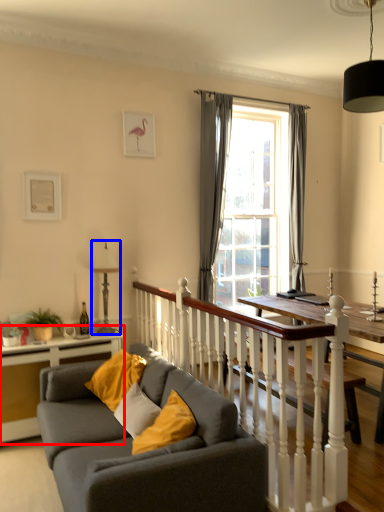
Question: Which of the following is the farthest to the observer, table (highlighted by a red box) or lamp (highlighted by a blue box)?

Choices:
 (A) table
 (B) lamp

Answer: (B)